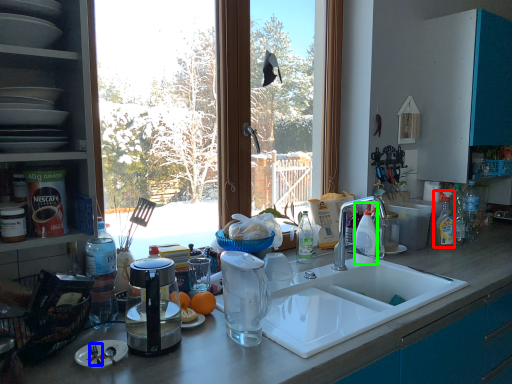
Question: Estimate the real-world distances between objects in this image. Which object is farther from cleaning product (highlighted by a red box), silverware (highlighted by a blue box) or bottle (highlighted by a green box)?

Choices:
 (A) silverware
 (B) bottle

Answer: (A)